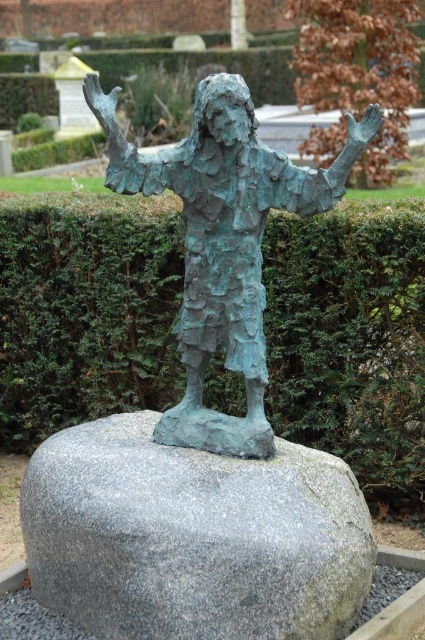
You are standing in the garden where the bronze statue stands. You want to place a small bouquet of flowers exactly at the location of the green textured hedge at center. What are the coordinates where you should place the bouquet?

The coordinates for the green textured hedge at center are point (x=351, y=339), so you should place the bouquet there.

You are a drone operator trying to capture aerial footage of the bronze statue. You have two points marked on your map for camera positioning. The first point is at coordinates point (x=306, y=516), and the second is at point (x=260, y=452). Which point is closer to the statue?

Point (x=306, y=516) is in front of point (x=260, y=452), so it is closer to the statue.